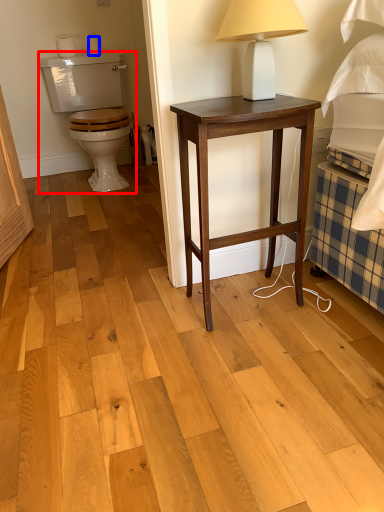
Question: Which point is further to the camera, armchair (highlighted by a red box) or toilet paper (highlighted by a blue box)?

Choices:
 (A) armchair
 (B) toilet paper

Answer: (B)